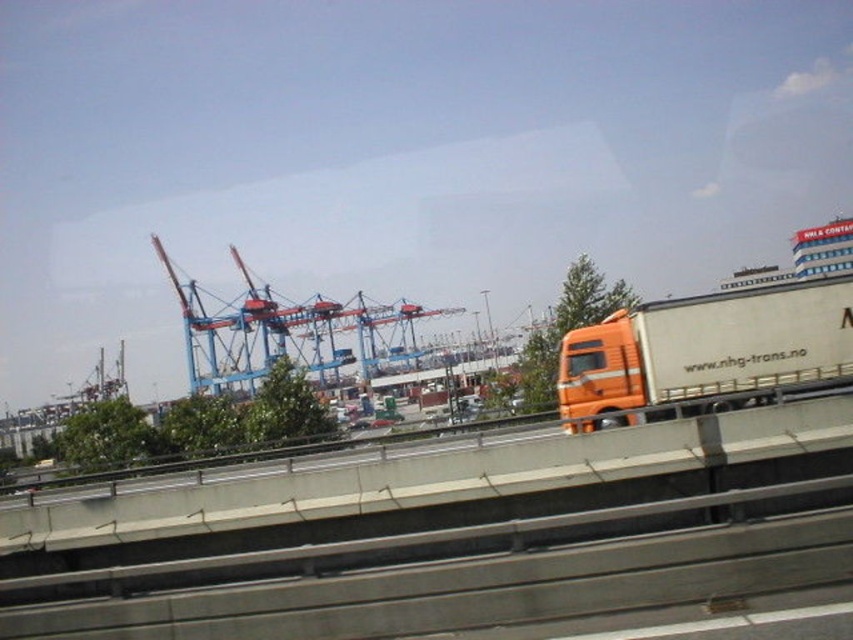
Question: Observing the image, what is the correct spatial positioning of concrete at center in reference to orange matte trailer truck at right?

Choices:
 (A) below
 (B) above

Answer: (A)

Question: Is concrete at center wider than orange matte trailer truck at right?

Choices:
 (A) no
 (B) yes

Answer: (B)

Question: Which point appears closest to the camera in this image?

Choices:
 (A) (772, 353)
 (B) (74, 506)

Answer: (B)

Question: Which of the following is the farthest from the observer?

Choices:
 (A) concrete at center
 (B) orange matte trailer truck at right

Answer: (B)

Question: Which point is farther to the camera?

Choices:
 (A) concrete at center
 (B) orange matte trailer truck at right

Answer: (B)

Question: Is concrete at center smaller than orange matte trailer truck at right?

Choices:
 (A) no
 (B) yes

Answer: (A)